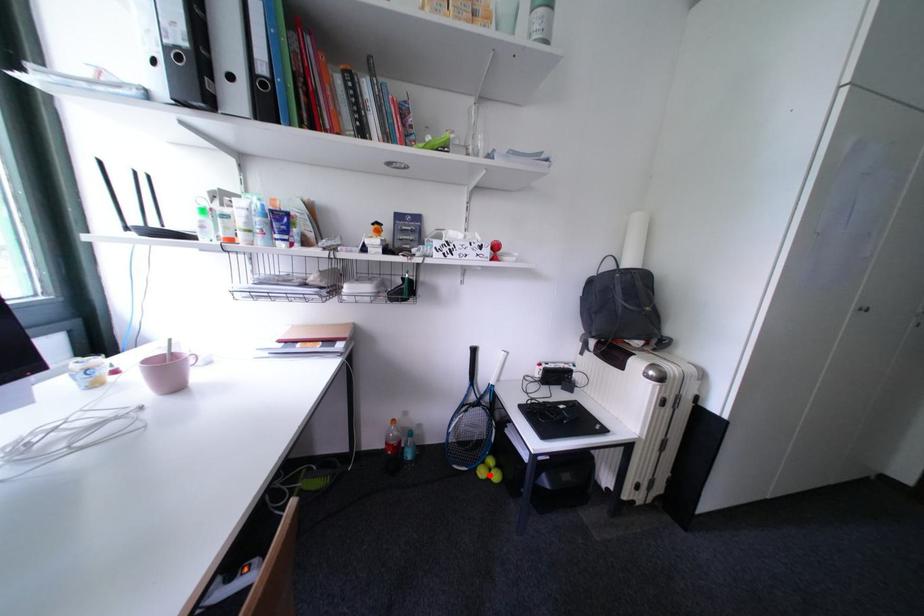
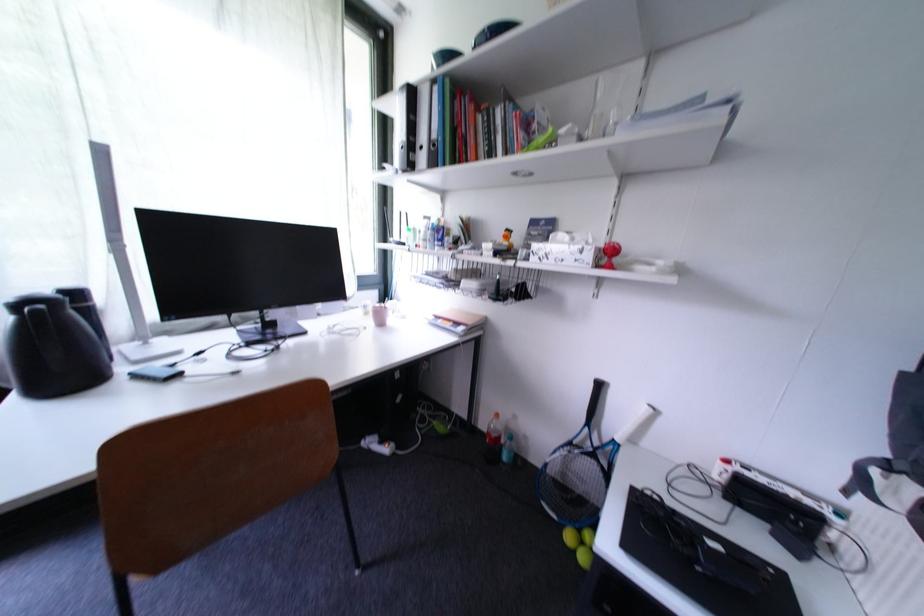
Question: I am providing you with two images of the same scene from different viewpoints. In image1, a red point is highlighted. Considering the same 3D point in image2, which of the following is correct?

Choices:
 (A) It is closer
 (B) It is farther

Answer: (A)